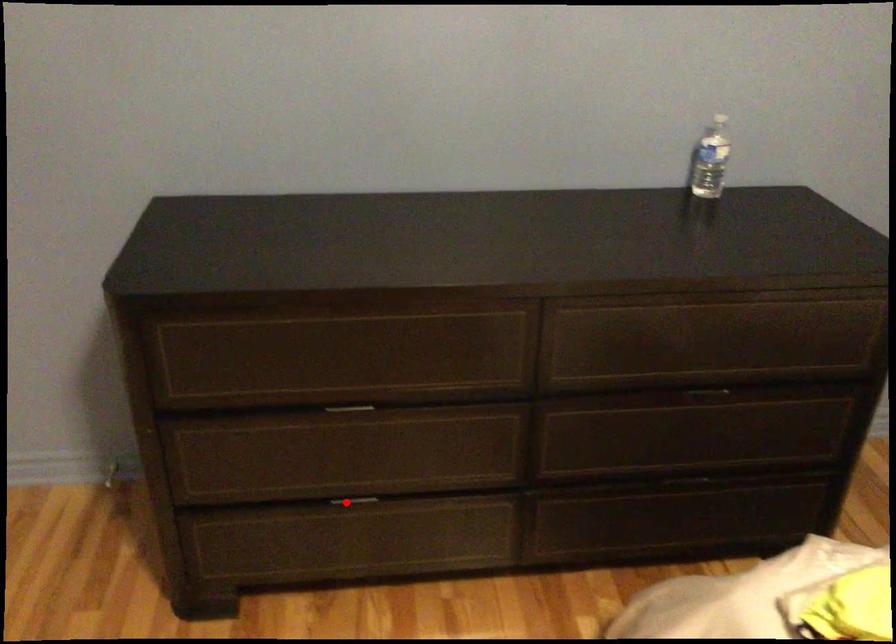
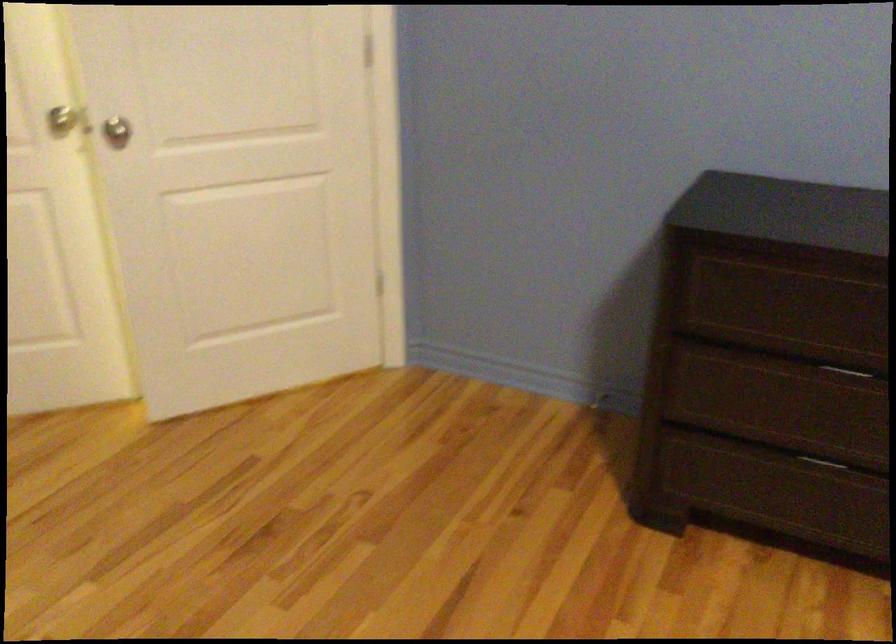
Locate, in the second image, the point that corresponds to the highlighted location in the first image.

(821, 462)